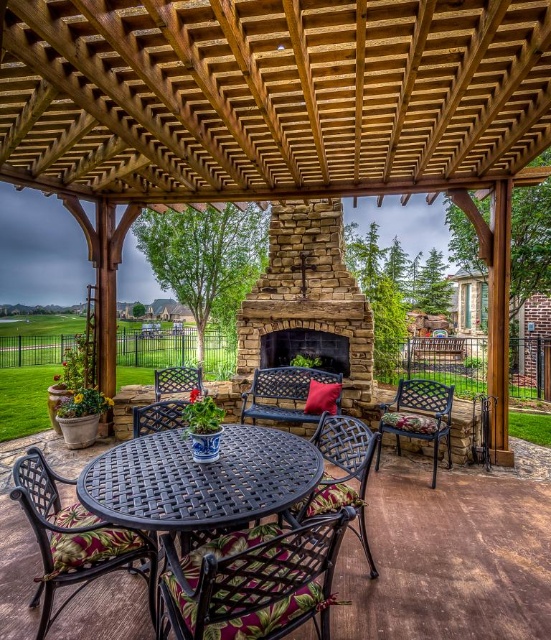
You are planning to place a 30 inch wide potted plant between the metallic black bench at center and the black stone fireplace at center. Based on the space available, will the potted plant fit between them?

The distance between the metallic black bench at center and the black stone fireplace at center is 26.76 inches. Since the potted plant is 30 inches wide, it will not fit between them as the space is narrower than the plant.